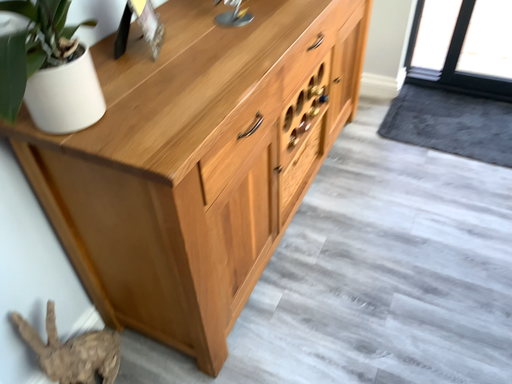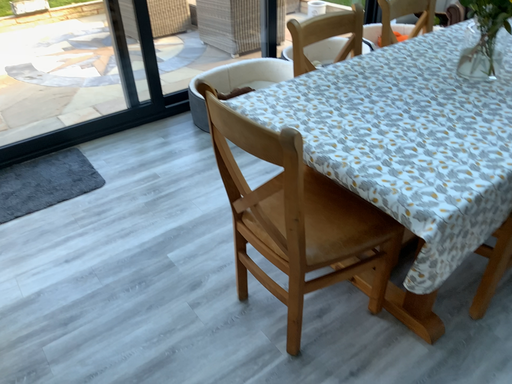
Question: How did the camera likely rotate when shooting the video?

Choices:
 (A) rotated downward
 (B) rotated upward

Answer: (B)